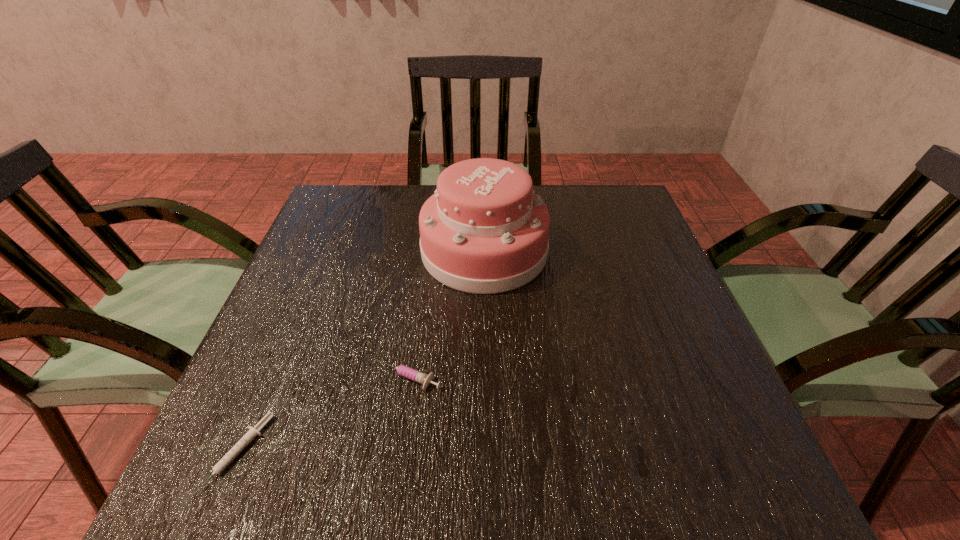
Image resolution: width=960 pixels, height=540 pixels. In order to click on object present at the near edge in this screenshot , I will do `click(253, 431)`.

Locate an element on the screen. object that is at the left edge is located at coordinates (253, 431).

The image size is (960, 540). In order to click on object that is at the near left corner in this screenshot , I will do `click(253, 431)`.

Find the location of a particular element. The image size is (960, 540). vacant space at the far edge of the desktop is located at coordinates (396, 199).

Locate an element on the screen. free space at the near edge of the desktop is located at coordinates (382, 492).

Find the location of a particular element. This screenshot has height=540, width=960. vacant region at the left edge is located at coordinates (304, 254).

The width and height of the screenshot is (960, 540). Identify the location of vacant region at the right edge. (716, 386).

Where is `vacant position at the far right corner of the desktop`? vacant position at the far right corner of the desktop is located at coordinates (578, 195).

Image resolution: width=960 pixels, height=540 pixels. In order to click on vacant space at the near right corner in this screenshot , I will do click(x=680, y=504).

Locate an element on the screen. This screenshot has width=960, height=540. free point between the birthday cake and the left syringe is located at coordinates (361, 353).